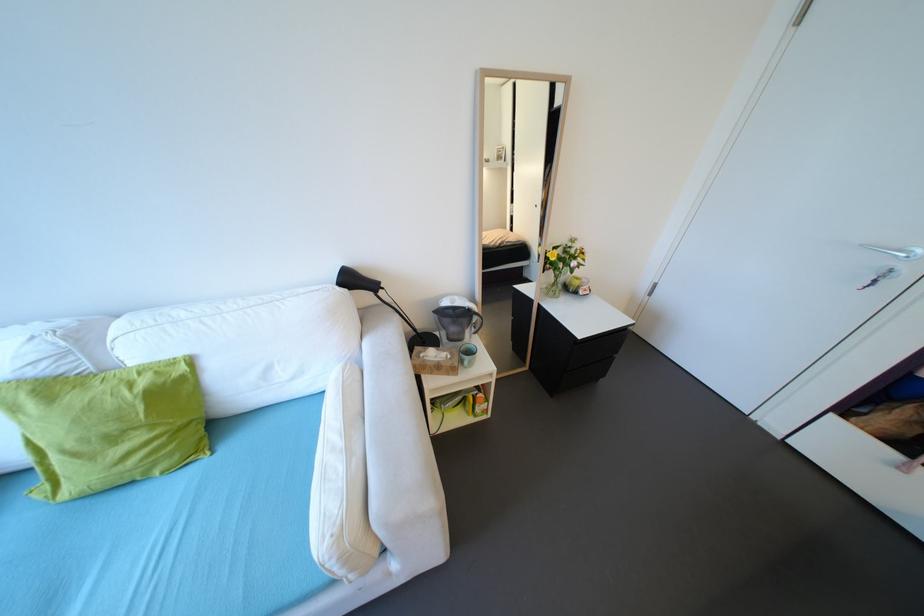
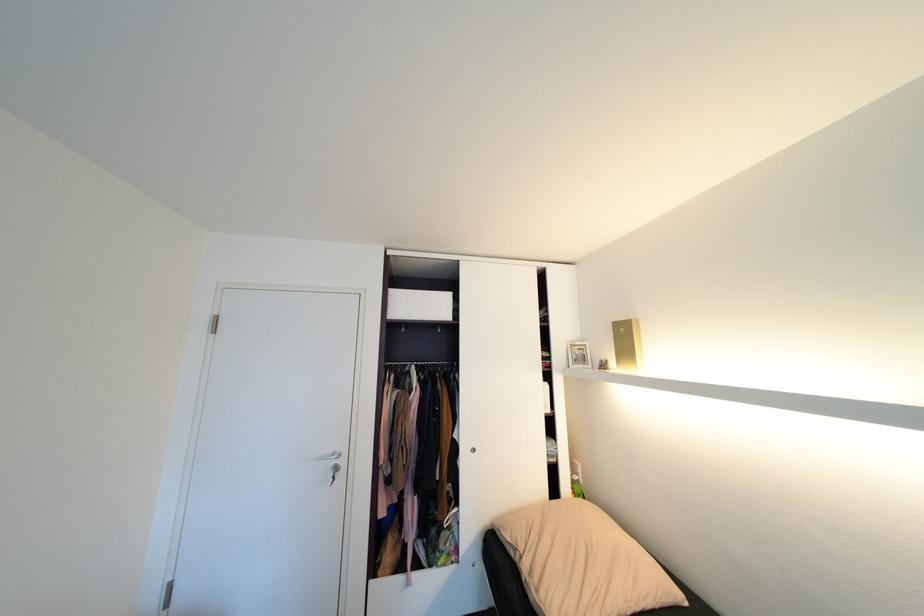
Find the pixel in the second image that matches (869,246) in the first image.

(322, 459)